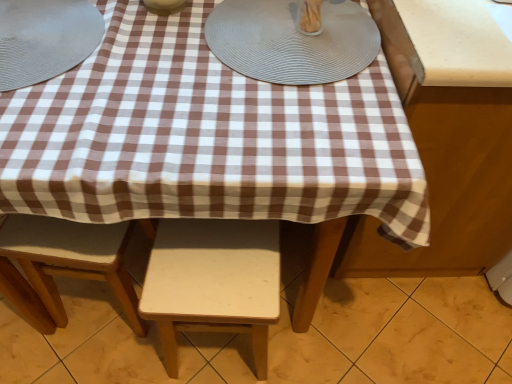
You are a GUI agent. You are given a task and a screenshot of the screen. Output one action in this format:
    pyautogui.click(x=<x>, y=<y>)
    Task: Click on the vacant area that is situated to the right of clear glass container at upper center, which is counted as the 3th tableware, starting from the left
    
    Given the screenshot: What is the action you would take?
    pyautogui.click(x=355, y=33)